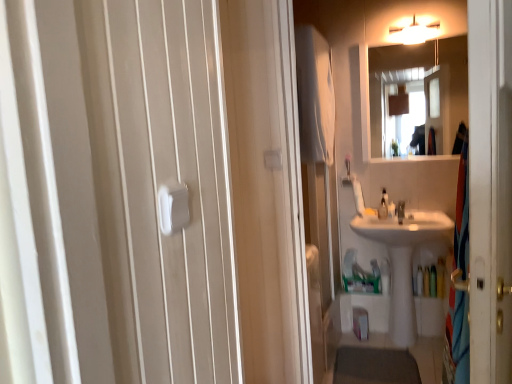
Image resolution: width=512 pixels, height=384 pixels. What are the coordinates of `white glossy sink at center` in the screenshot? It's located at (402, 259).

The height and width of the screenshot is (384, 512). Describe the element at coordinates (173, 207) in the screenshot. I see `white plastic towel bar at center` at that location.

What do you see at coordinates (490, 189) in the screenshot?
I see `transparent plastic screen door at right` at bounding box center [490, 189].

Measure the distance between point (495, 135) and camera.

Point (495, 135) is 31.46 inches away from camera.

This screenshot has width=512, height=384. I want to click on white soft towel at upper center, so click(315, 96).

Describe the element at coordinates (419, 281) in the screenshot. The image size is (512, 384). I see `translucent plastic bottle at right, the second toiletry from the right` at that location.

Locate an element on the screen. The image size is (512, 384). white glossy sink at center is located at coordinates (402, 259).

Can you confirm if translucent plastic bottle at lower right, arranged as the second toiletry when viewed from the left, is positioned to the right of translucent plastic soap dispenser at center?

Correct, you'll find translucent plastic bottle at lower right, arranged as the second toiletry when viewed from the left, to the right of translucent plastic soap dispenser at center.

From a real-world perspective, is translucent plastic bottle at lower right, arranged as the second toiletry when viewed from the left, physically located above or below translucent plastic soap dispenser at center?

translucent plastic bottle at lower right, arranged as the second toiletry when viewed from the left, is situated lower than translucent plastic soap dispenser at center in the real world.

Is translucent plastic bottle at lower right, arranged as the second toiletry when viewed from the left, inside or outside of translucent plastic soap dispenser at center?

translucent plastic bottle at lower right, arranged as the second toiletry when viewed from the left, is spatially situated outside translucent plastic soap dispenser at center.

From the image's perspective, is translucent plastic bottle at lower right, which is the first toiletry from right to left, under translucent plastic soap dispenser at center?

Indeed, from the image's perspective, translucent plastic bottle at lower right, which is the first toiletry from right to left, is shown beneath translucent plastic soap dispenser at center.

Which object is positioned more to the right, translucent plastic bottle at right, the second toiletry from the right, or translucent plastic bottle at lower right, arranged as the second toiletry when viewed from the left?

translucent plastic bottle at lower right, arranged as the second toiletry when viewed from the left, is more to the right.

Is translucent plastic bottle at right, which is counted as the 1th toiletry, starting from the left, facing away from translucent plastic bottle at lower right, which is the first toiletry from right to left?

No, translucent plastic bottle at right, which is counted as the 1th toiletry, starting from the left,'s orientation is not away from translucent plastic bottle at lower right, which is the first toiletry from right to left.

Could translucent plastic bottle at lower right, arranged as the second toiletry when viewed from the left, be considered to be inside translucent plastic bottle at right, which is counted as the 1th toiletry, starting from the left?

No, translucent plastic bottle at lower right, arranged as the second toiletry when viewed from the left, is not surrounded by translucent plastic bottle at right, which is counted as the 1th toiletry, starting from the left.

The height and width of the screenshot is (384, 512). In order to click on toiletry on the left side of translucent plastic bottle at lower right, which is the first toiletry from right to left in this screenshot , I will do `click(419, 281)`.

In the scene shown: From a real-world perspective, relative to transparent plastic screen door at right, is white glossy mirror at upper center vertically above or below?

In terms of real-world spatial position, white glossy mirror at upper center is above transparent plastic screen door at right.

Is white glossy mirror at upper center to the right of transparent plastic screen door at right from the viewer's perspective?

Correct, you'll find white glossy mirror at upper center to the right of transparent plastic screen door at right.

This screenshot has width=512, height=384. What are the coordinates of `mirror on the right side of transparent plastic screen door at right` in the screenshot? It's located at (398, 62).

What's the angular difference between white glossy mirror at upper center and transparent plastic screen door at right's facing directions?

white glossy mirror at upper center and transparent plastic screen door at right are facing 102 degrees away from each other.

Is translucent plastic soap dispenser at center positioned in front of transparent plastic screen door at right?

No, the depth of translucent plastic soap dispenser at center is greater than that of transparent plastic screen door at right.

Is translucent plastic soap dispenser at center thinner than transparent plastic screen door at right?

In fact, translucent plastic soap dispenser at center might be wider than transparent plastic screen door at right.

Would you say translucent plastic soap dispenser at center is to the left or to the right of transparent plastic screen door at right in the picture?

translucent plastic soap dispenser at center is positioned on transparent plastic screen door at right's right side.

Can you confirm if white soft towel at upper center is positioned to the right of white plastic towel bar at center?

Indeed, white soft towel at upper center is positioned on the right side of white plastic towel bar at center.

Which is less distant, (332,153) or (162,189)?

Clearly, point (332,153) is more distant from the camera than point (162,189).

Identify the location of bath towel behind the white plastic towel bar at center. (315, 96).

Is white soft towel at upper center in front of or behind white plastic towel bar at center in the image?

In the image, white soft towel at upper center appears behind white plastic towel bar at center.

There is a translucent plastic soap dispenser at center. Where is `towel bar above it (from a real-world perspective)`? towel bar above it (from a real-world perspective) is located at coordinates (173, 207).

Between translucent plastic soap dispenser at center and white plastic towel bar at center, which one has larger width?

translucent plastic soap dispenser at center.

Is translucent plastic soap dispenser at center behind white plastic towel bar at center?

Yes, it is behind white plastic towel bar at center.

Between translucent plastic soap dispenser at center and white plastic towel bar at center, which one appears on the right side from the viewer's perspective?

translucent plastic soap dispenser at center is more to the right.

Is translucent plastic bottle at right, which is counted as the 1th toiletry, starting from the left, surrounding white soft towel at upper center?

Definitely not — white soft towel at upper center is not inside translucent plastic bottle at right, which is counted as the 1th toiletry, starting from the left.

From the image's perspective, relative to white soft towel at upper center, is translucent plastic bottle at right, which is counted as the 1th toiletry, starting from the left, above or below?

From the image's perspective, translucent plastic bottle at right, which is counted as the 1th toiletry, starting from the left, appears below white soft towel at upper center.

Looking at this image, can you confirm if translucent plastic bottle at right, the second toiletry from the right, is thinner than white soft towel at upper center?

Correct, the width of translucent plastic bottle at right, the second toiletry from the right, is less than that of white soft towel at upper center.

Considering the positions of points (422, 287) and (318, 122), is point (422, 287) farther from camera compared to point (318, 122)?

That is True.

There is a translucent plastic bottle at lower right, which is the first toiletry from right to left. Identify the location of soap dispenser above it (from a real-world perspective). (383, 206).

I want to click on toiletry above the translucent plastic bottle at right, which is counted as the 1th toiletry, starting from the left (from the image's perspective), so click(x=426, y=282).

When comparing their distances from translucent plastic bottle at lower right, which is the first toiletry from right to left, does translucent plastic bottle at right, which is counted as the 1th toiletry, starting from the left, or transparent plastic screen door at right seem further?

transparent plastic screen door at right is positioned further to the anchor translucent plastic bottle at lower right, which is the first toiletry from right to left.

Considering their positions, is translucent plastic soap dispenser at center positioned further to transparent plastic screen door at right than white soft towel at upper center?

translucent plastic soap dispenser at center is positioned further to the anchor transparent plastic screen door at right.

From the image, which object appears to be nearer to transparent plastic screen door at right, translucent plastic bottle at lower right, which is the first toiletry from right to left, or white soft towel at upper center?

Among the two, white soft towel at upper center is located nearer to transparent plastic screen door at right.

When comparing their distances from white soft towel at upper center, does transparent plastic screen door at right or translucent plastic bottle at right, which is counted as the 1th toiletry, starting from the left, seem further?

transparent plastic screen door at right.

Considering their positions, is translucent plastic bottle at lower right, arranged as the second toiletry when viewed from the left, positioned closer to translucent plastic bottle at right, the second toiletry from the right, than translucent plastic soap dispenser at center?

translucent plastic bottle at lower right, arranged as the second toiletry when viewed from the left, is closer to translucent plastic bottle at right, the second toiletry from the right.

Based on their spatial positions, is white glossy mirror at upper center or white soft towel at upper center closer to translucent plastic bottle at lower right, arranged as the second toiletry when viewed from the left?

white soft towel at upper center is positioned closer to the anchor translucent plastic bottle at lower right, arranged as the second toiletry when viewed from the left.

Considering their positions, is translucent plastic bottle at right, the second toiletry from the right, positioned further to white soft towel at upper center than translucent plastic bottle at lower right, arranged as the second toiletry when viewed from the left?

translucent plastic bottle at lower right, arranged as the second toiletry when viewed from the left, is further to white soft towel at upper center.

When comparing their distances from transparent plastic screen door at right, does translucent plastic bottle at lower right, which is the first toiletry from right to left, or white glossy mirror at upper center seem further?

white glossy mirror at upper center lies further to transparent plastic screen door at right than the other object.

Identify the location of sink that lies between white glossy mirror at upper center and translucent plastic bottle at right, which is counted as the 1th toiletry, starting from the left, from top to bottom. (402, 259).

Identify the location of sink located between transparent plastic screen door at right and translucent plastic soap dispenser at center in the depth direction. (402, 259).

You are a GUI agent. You are given a task and a screenshot of the screen. Output one action in this format:
    pyautogui.click(x=<x>, y=<y>)
    Task: Click on the bath towel positioned between white plastic towel bar at center and white glossy mirror at upper center from near to far
    
    Given the screenshot: What is the action you would take?
    pyautogui.click(x=315, y=96)

What are the coordinates of `screen door between white plastic towel bar at center and translucent plastic bottle at right, the second toiletry from the right, along the z-axis` in the screenshot? It's located at tap(490, 189).